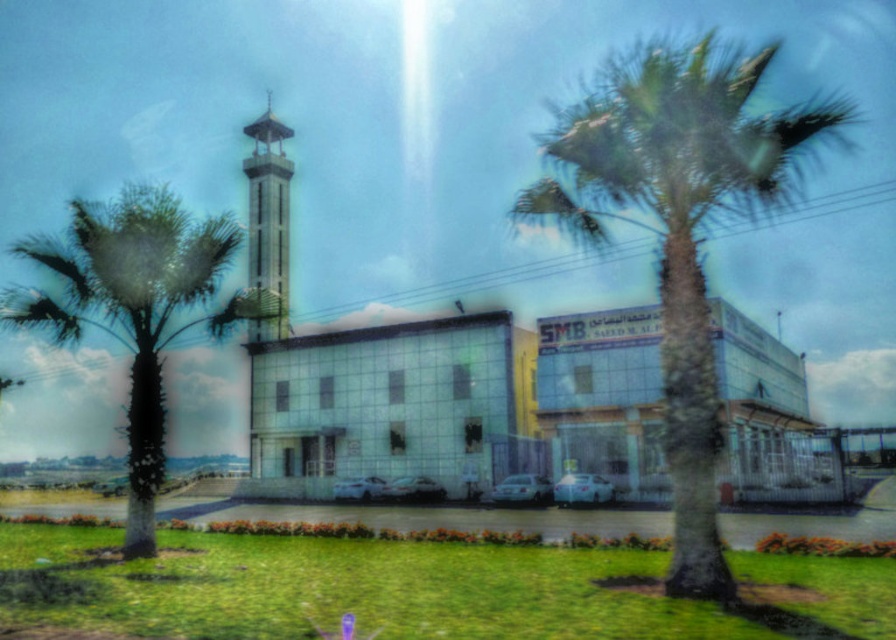
From the picture: Between green matte car at center and white glossy car at center, which one is positioned lower?

white glossy car at center is lower down.

Is green matte car at center positioned behind white glossy car at center?

No, green matte car at center is in front of white glossy car at center.

Between point (582, 488) and point (339, 499), which one is positioned behind?

Point (339, 499)

I want to click on green matte car at center, so click(x=582, y=490).

Measure the distance between silver metallic car at center and matte white car at center.

silver metallic car at center is 31.01 feet away from matte white car at center.

Does silver metallic car at center have a lesser width compared to matte white car at center?

Indeed, silver metallic car at center has a lesser width compared to matte white car at center.

Is point (535, 492) closer to viewer compared to point (403, 490)?

Yes, it is in front of point (403, 490).

Image resolution: width=896 pixels, height=640 pixels. What are the coordinates of `silver metallic car at center` in the screenshot? It's located at (521, 490).

Is white glass bell tower at center taller than white glossy car at center?

Indeed, white glass bell tower at center has a greater height compared to white glossy car at center.

Which of these two, white glass bell tower at center or white glossy car at center, stands taller?

Standing taller between the two is white glass bell tower at center.

Is point (268, 211) farther from viewer compared to point (337, 481)?

Yes, point (268, 211) is behind point (337, 481).

This screenshot has width=896, height=640. I want to click on white glass bell tower at center, so click(x=268, y=220).